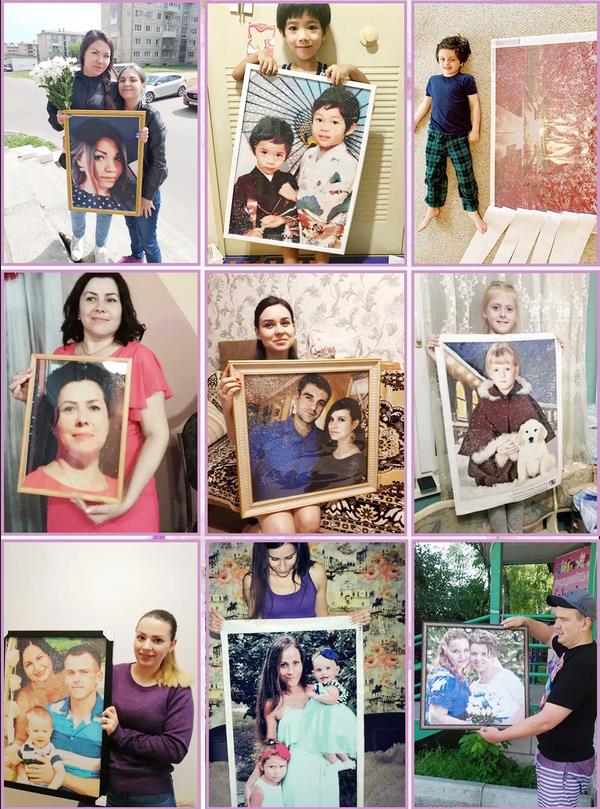
At what (x,y) coordinates should I click in order to perform the action: click on portraits. Please return your answer as a coordinate pair (x, y). This screenshot has width=600, height=809. Looking at the image, I should click on (99, 150), (284, 91), (468, 358), (271, 386), (115, 362), (61, 654), (317, 640), (464, 649).